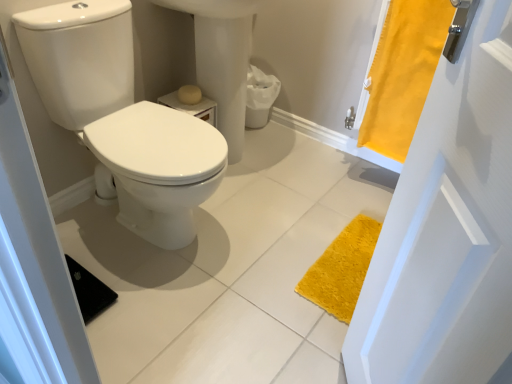
Where is `vacant area that is in front of white glossy sink at center`? vacant area that is in front of white glossy sink at center is located at coordinates (264, 213).